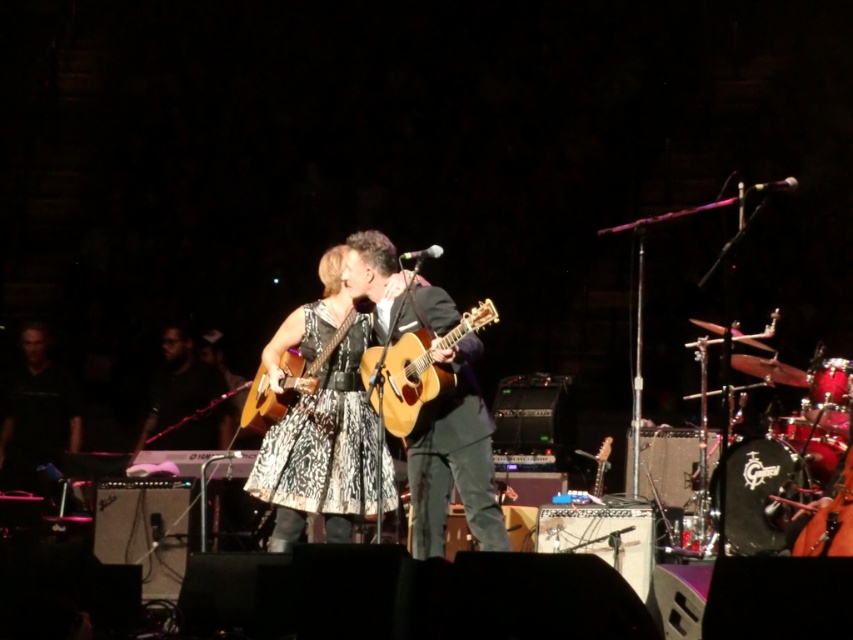
Question: Which of these objects is positioned closest to the matte brown acoustic guitar at center?

Choices:
 (A) printed fabric dress at center
 (B) acoustic wood guitar at center
 (C) matte black guitar at center

Answer: (B)

Question: Among these points, which one is farthest from the camera?

Choices:
 (A) (467, 474)
 (B) (347, 298)

Answer: (B)

Question: Which point is closer to the camera?

Choices:
 (A) shiny orange guitar at center
 (B) black matte shirt at left
 (C) acoustic wood guitar at center

Answer: (A)

Question: Considering the relative positions of printed fabric dress at center and black matte shirt at left in the image provided, where is printed fabric dress at center located with respect to black matte shirt at left?

Choices:
 (A) above
 (B) below

Answer: (A)

Question: Can you confirm if black matte shirt at left is positioned below black textured shirt at center?

Choices:
 (A) yes
 (B) no

Answer: (A)

Question: Does printed fabric dress at center appear over matte black guitar at center?

Choices:
 (A) no
 (B) yes

Answer: (A)